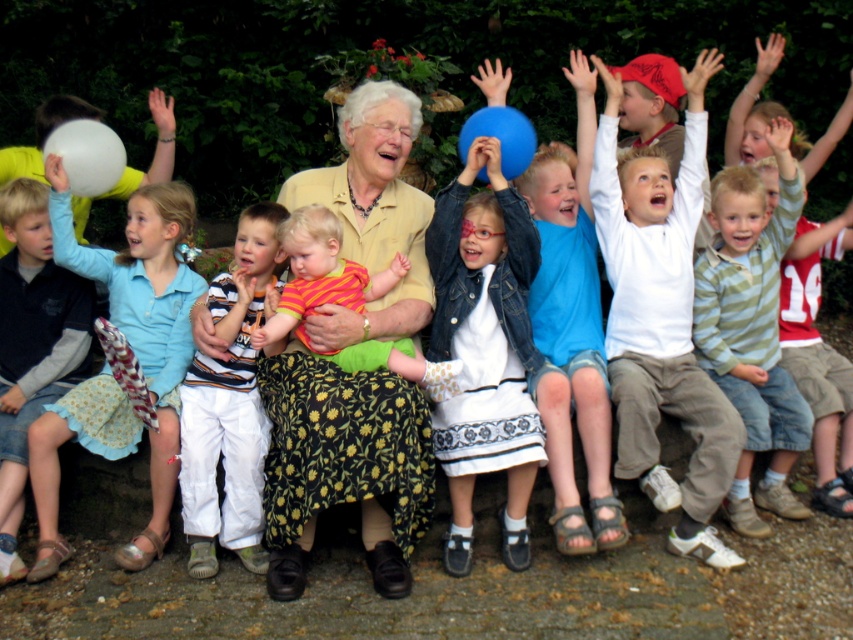
You are standing in the park and see the light blue cotton dress at left. Can you tell me where it is located in the scene?

The light blue cotton dress at left is located at point 0.495 on the x axis and 0.169 on the y axis.

You are a fashion designer observing the outdoor scene. You notice the light blue cotton dress at left and the white cotton pants at center. Which clothing item has a greater width?

The light blue cotton dress at left has a greater width than the white cotton pants at center.